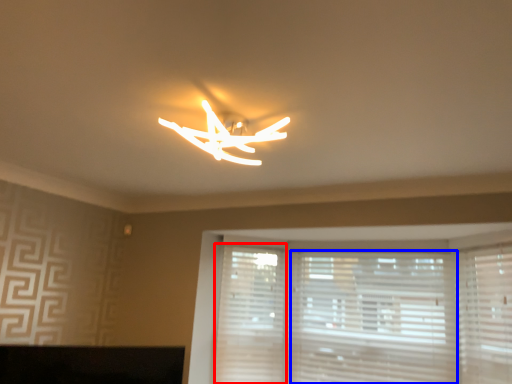
Question: Which of the following is the farthest to the observer, shutter (highlighted by a red box) or blind (highlighted by a blue box)?

Choices:
 (A) shutter
 (B) blind

Answer: (A)